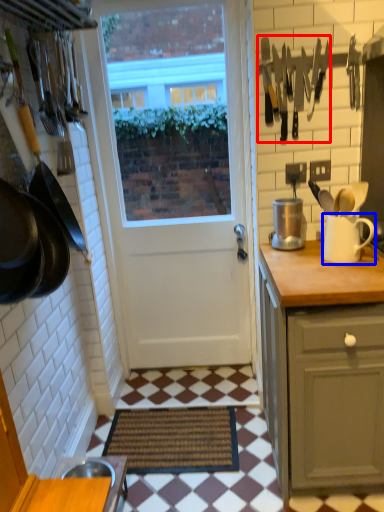
Question: Among these objects, which one is farthest to the camera, cutlery (highlighted by a red box) or jug (highlighted by a blue box)?

Choices:
 (A) cutlery
 (B) jug

Answer: (A)